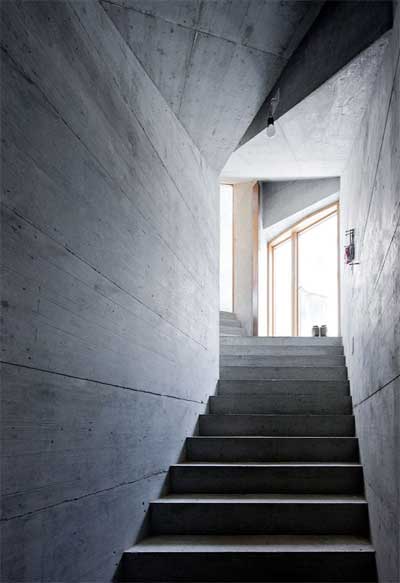
The height and width of the screenshot is (583, 400). I want to click on light bulb, so click(x=271, y=132).